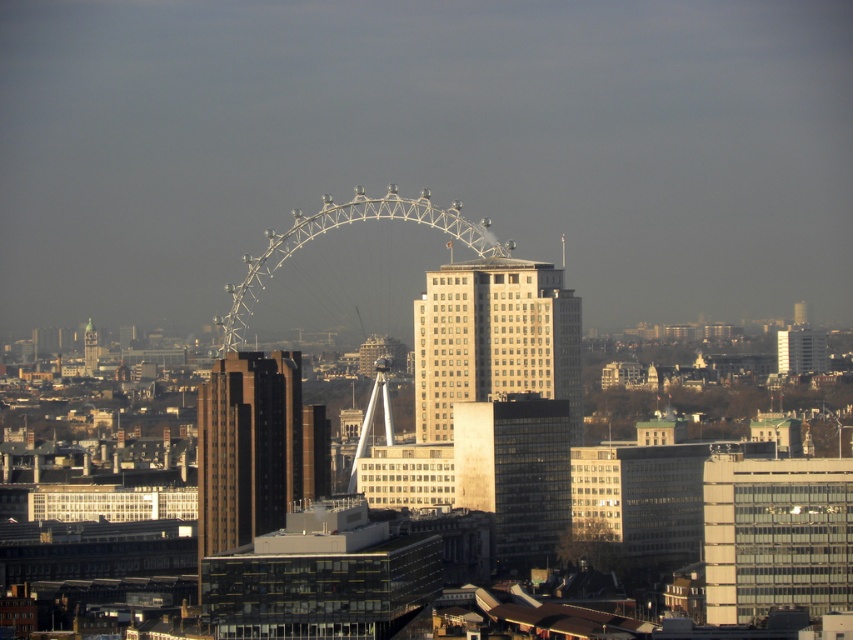
Question: Considering the relative positions of beige glass building at center and glassy reflective building at center in the image provided, where is beige glass building at center located with respect to glassy reflective building at center?

Choices:
 (A) right
 (B) left

Answer: (B)

Question: Does beige glass building at center appear over green glass tower at left?

Choices:
 (A) yes
 (B) no

Answer: (B)

Question: Is beige glass building at center behind glassy reflective building at center?

Choices:
 (A) yes
 (B) no

Answer: (B)

Question: Which of the following is the farthest from the observer?

Choices:
 (A) brown glassy building at center-left
 (B) green glass tower at left

Answer: (B)

Question: Which point is farther from the camera taking this photo?

Choices:
 (A) (221, 404)
 (B) (552, 392)

Answer: (A)

Question: Which of the following is the farthest from the observer?

Choices:
 (A) (222, 524)
 (B) (473, 365)
 (C) (488, 401)
 (D) (91, 371)

Answer: (D)